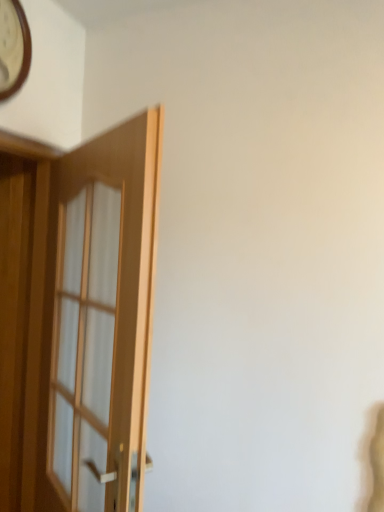
Describe the element at coordinates (92, 322) in the screenshot. I see `light brown wooden door at left` at that location.

The width and height of the screenshot is (384, 512). In order to click on light brown wooden door at left in this screenshot , I will do `click(92, 322)`.

What is the approximate width of wooden clock at upper left?

wooden clock at upper left is 2.79 inches wide.

What is the approximate height of wooden clock at upper left?

It is 39.25 centimeters.

What do you see at coordinates (13, 48) in the screenshot?
I see `wooden clock at upper left` at bounding box center [13, 48].

Where is `wooden clock at upper left`? Image resolution: width=384 pixels, height=512 pixels. wooden clock at upper left is located at coordinates (13, 48).

Image resolution: width=384 pixels, height=512 pixels. I want to click on light brown wooden door at left, so click(92, 322).

Does light brown wooden door at left appear on the right side of wooden clock at upper left?

Yes, light brown wooden door at left is to the right of wooden clock at upper left.

Does light brown wooden door at left come in front of wooden clock at upper left?

Yes.

Which is behind, point (133, 206) or point (17, 1)?

The point (17, 1) is behind.

From the image's perspective, who appears lower, light brown wooden door at left or wooden clock at upper left?

light brown wooden door at left appears lower in the image.

From a real-world perspective, is light brown wooden door at left below wooden clock at upper left?

Yes, from a real-world perspective, light brown wooden door at left is below wooden clock at upper left.

Looking at their sizes, would you say light brown wooden door at left is wider or thinner than wooden clock at upper left?

light brown wooden door at left is wider than wooden clock at upper left.

From the picture: Does light brown wooden door at left have a greater height compared to wooden clock at upper left?

Yes, light brown wooden door at left is taller than wooden clock at upper left.

Which of these two, light brown wooden door at left or wooden clock at upper left, is smaller?

wooden clock at upper left.

Would you say light brown wooden door at left is inside or outside wooden clock at upper left?

light brown wooden door at left lies outside wooden clock at upper left.

Does light brown wooden door at left touch wooden clock at upper left?

→ light brown wooden door at left and wooden clock at upper left are clearly separated.

Could you tell me if light brown wooden door at left is turned towards wooden clock at upper left?

No, light brown wooden door at left is not aimed at wooden clock at upper left.

How different are the orientations of light brown wooden door at left and wooden clock at upper left in degrees?

127 degrees.

Find the location of a particular element. This screenshot has width=384, height=512. door below the wooden clock at upper left (from the image's perspective) is located at coordinates (92, 322).

Between wooden clock at upper left and light brown wooden door at left, which one appears on the left side from the viewer's perspective?

wooden clock at upper left is more to the left.

Considering the positions of objects wooden clock at upper left and light brown wooden door at left in the image provided, who is behind, wooden clock at upper left or light brown wooden door at left?

wooden clock at upper left is more distant.

Does point (11, 60) lie in front of point (94, 414)?

No, (11, 60) is further to viewer.

From the image's perspective, which one is positioned lower, wooden clock at upper left or light brown wooden door at left?

From the image's view, light brown wooden door at left is below.

From a real-world perspective, does wooden clock at upper left sit lower than light brown wooden door at left?

No.

Can you confirm if wooden clock at upper left is thinner than light brown wooden door at left?

Yes, wooden clock at upper left is thinner than light brown wooden door at left.

In terms of height, does wooden clock at upper left look taller or shorter compared to light brown wooden door at left?

Considering their sizes, wooden clock at upper left has less height than light brown wooden door at left.

Is wooden clock at upper left smaller than light brown wooden door at left?

Correct, wooden clock at upper left occupies less space than light brown wooden door at left.

Do you think wooden clock at upper left is within light brown wooden door at left, or outside of it?

wooden clock at upper left exists outside the volume of light brown wooden door at left.

Is wooden clock at upper left in contact with light brown wooden door at left?

No, wooden clock at upper left is not next to light brown wooden door at left.

Is wooden clock at upper left looking in the opposite direction of light brown wooden door at left?

No, wooden clock at upper left is not facing away from light brown wooden door at left.

Locate an element on the screen. This screenshot has height=512, width=384. door below the wooden clock at upper left (from the image's perspective) is located at coordinates (92, 322).

Image resolution: width=384 pixels, height=512 pixels. What are the coordinates of `door on the right of wooden clock at upper left` in the screenshot? It's located at (92, 322).

Identify the location of clock above the light brown wooden door at left (from a real-world perspective). pos(13,48).